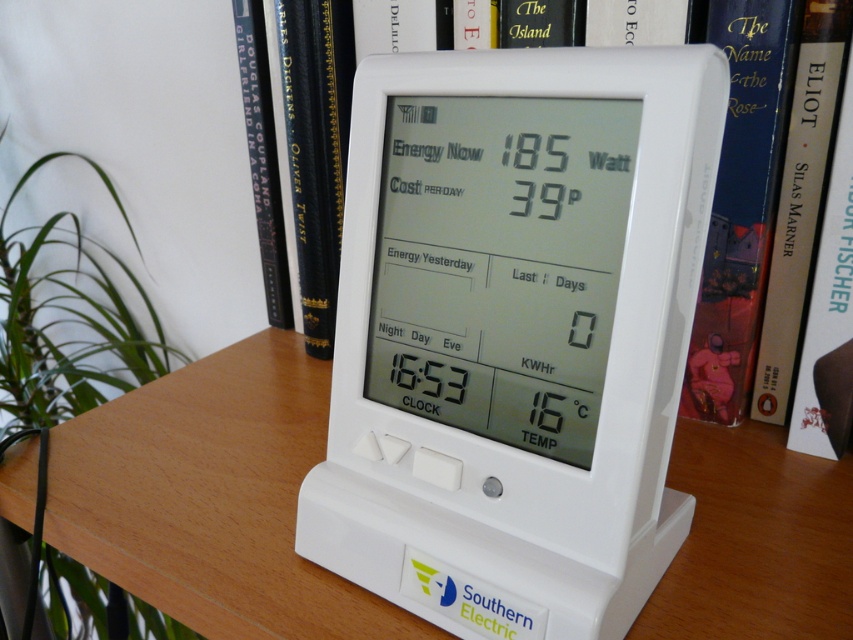
Does hardcover book at upper right come in front of hardcover book at upper center?

No.

Which of these two, hardcover book at upper right or hardcover book at upper center, stands shorter?

Standing shorter between the two is hardcover book at upper center.

Between point (724, 42) and point (838, 65), which one is positioned behind?

Point (724, 42)

I want to click on hardcover book at upper right, so click(x=741, y=202).

Does white plastic thermometer at center appear over white plastic table at center?

Indeed, white plastic thermometer at center is positioned over white plastic table at center.

Who is shorter, white plastic thermometer at center or white plastic table at center?

white plastic table at center

This screenshot has height=640, width=853. Identify the location of white plastic thermometer at center. (515, 333).

Is white plastic thermometer at center wider than hardcover book at center?

Yes, white plastic thermometer at center is wider than hardcover book at center.

Is point (676, 266) closer to camera compared to point (251, 129)?

Yes, it is.

At what (x,y) coordinates should I click in order to perform the action: click on white plastic thermometer at center. Please return your answer as a coordinate pair (x, y). This screenshot has height=640, width=853. Looking at the image, I should click on (515, 333).